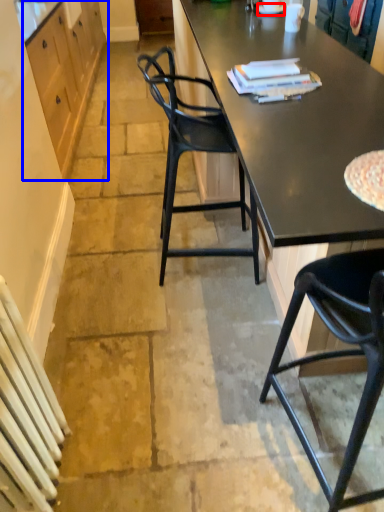
Question: Which point is closer to the camera, plate (highlighted by a red box) or cabinetry (highlighted by a blue box)?

Choices:
 (A) plate
 (B) cabinetry

Answer: (B)